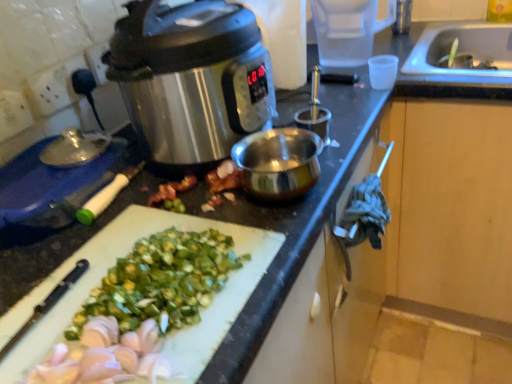
Question: From the image's perspective, is white plastic cutting board at lower left on stainless steel slow cooker at upper left?

Choices:
 (A) no
 (B) yes

Answer: (A)

Question: From a real-world perspective, is white plastic cutting board at lower left physically above stainless steel slow cooker at upper left?

Choices:
 (A) no
 (B) yes

Answer: (A)

Question: Is stainless steel slow cooker at upper left at the back of white plastic cutting board at lower left?

Choices:
 (A) no
 (B) yes

Answer: (A)

Question: Is white plastic cutting board at lower left bigger than stainless steel slow cooker at upper left?

Choices:
 (A) yes
 (B) no

Answer: (B)

Question: Is white plastic cutting board at lower left outside stainless steel slow cooker at upper left?

Choices:
 (A) no
 (B) yes

Answer: (B)

Question: Relative to white plastic cutting board at lower left, is stainless steel slow cooker at upper left in front or behind?

Choices:
 (A) behind
 (B) front

Answer: (A)

Question: Is stainless steel slow cooker at upper left inside or outside of white plastic cutting board at lower left?

Choices:
 (A) inside
 (B) outside

Answer: (B)

Question: Considering the positions of stainless steel slow cooker at upper left and white plastic cutting board at lower left in the image, is stainless steel slow cooker at upper left bigger or smaller than white plastic cutting board at lower left?

Choices:
 (A) big
 (B) small

Answer: (A)

Question: From a real-world perspective, is stainless steel slow cooker at upper left above or below white plastic cutting board at lower left?

Choices:
 (A) below
 (B) above

Answer: (B)

Question: Is point (10, 357) positioned closer to the camera than point (172, 89)?

Choices:
 (A) closer
 (B) farther

Answer: (A)

Question: Would you say white plastic cutting board at lower left is inside or outside stainless steel slow cooker at upper left?

Choices:
 (A) inside
 (B) outside

Answer: (B)

Question: From a real-world perspective, is white plastic cutting board at lower left above or below stainless steel slow cooker at upper left?

Choices:
 (A) above
 (B) below

Answer: (B)

Question: Based on their sizes in the image, would you say white plastic cutting board at lower left is bigger or smaller than stainless steel slow cooker at upper left?

Choices:
 (A) small
 (B) big

Answer: (A)

Question: Is white plastic cutting board at lower left spatially inside transparent plastic cup at upper right, or outside of it?

Choices:
 (A) inside
 (B) outside

Answer: (B)

Question: Looking at their shapes, would you say white plastic cutting board at lower left is wider or thinner than transparent plastic cup at upper right?

Choices:
 (A) thin
 (B) wide

Answer: (B)